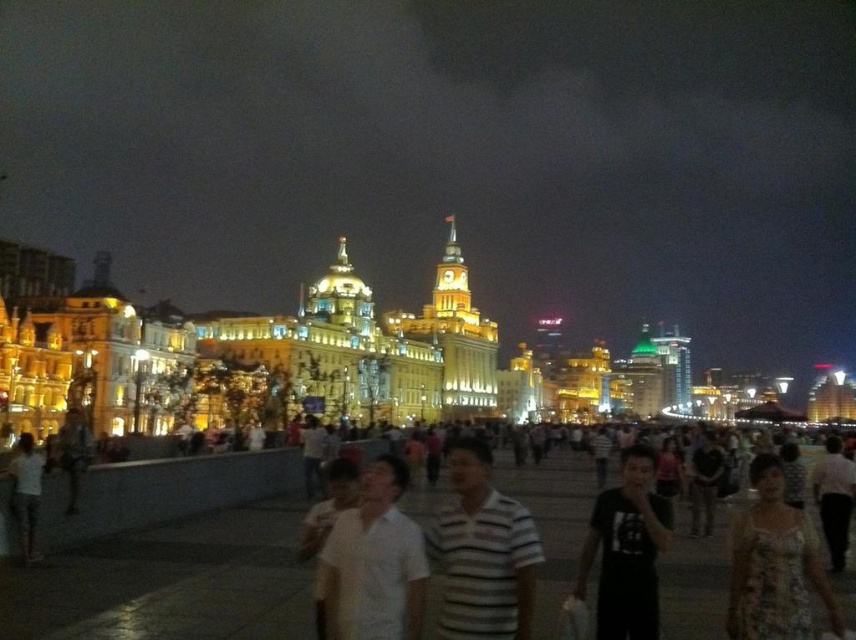
You are a photographer trying to capture the crowd in the plaza. You notice the white matte shirt at center and the floral dress at lower right. Which of these two people is closer to your camera lens?

The white matte shirt at center is closer to the camera lens because it is in front of the floral dress at lower right.

You are standing at the center of the plaza and see two points marked in the image. The first point is at coordinates point (421, 620) and the second point is at point (800, 605). Which point is closer to you?

Point (421, 620) is in front of point (800, 605), so it is closer to you.

You are a photographer trying to capture a candid shot of both the floral dress at lower right and the black matte shirt at center without moving your camera position. Given the current spacing between them, can you fit both subjects into your frame?

The floral dress at lower right might be wider than black matte shirt at center, so there is a possibility that the width of the floral dress at lower right could make it difficult to fit both into the frame without adjusting the camera angle or zoom. However, without exact measurements, it is uncertain.